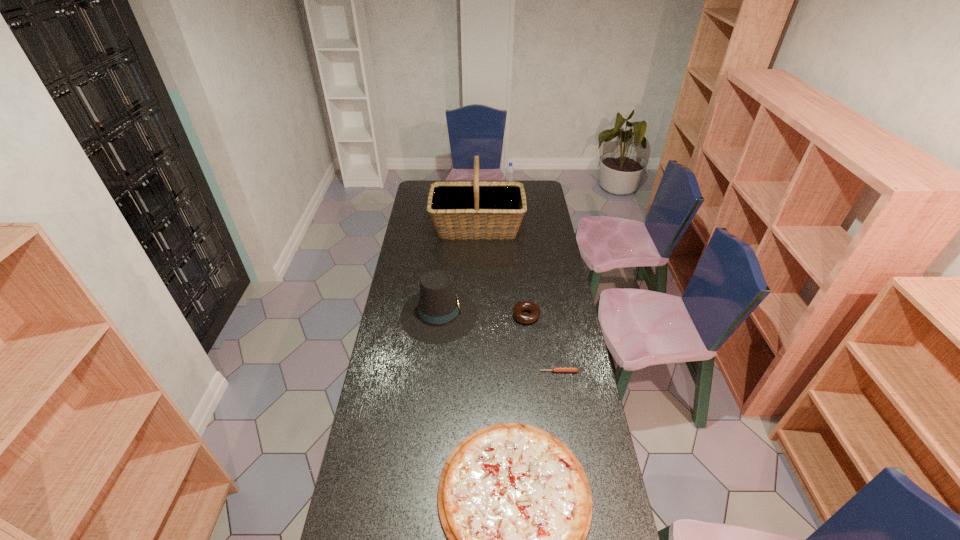
Image resolution: width=960 pixels, height=540 pixels. What are the coordinates of `vacant space that satisfies the following two spatial constraints: 1. on the front-facing side of the hat; 2. on the back side of the second nearest object` in the screenshot? It's located at (433, 372).

Identify the location of free location that satisfies the following two spatial constraints: 1. by the handle of the basket; 2. on the back side of the sausage. This screenshot has height=540, width=960. click(476, 372).

The width and height of the screenshot is (960, 540). What are the coordinates of `vacant position in the image that satisfies the following two spatial constraints: 1. on the back side of the shortest object; 2. on the front-facing side of the hat` in the screenshot? It's located at (549, 314).

Where is `free space that satisfies the following two spatial constraints: 1. by the handle of the tallest object; 2. on the left side of the doughnut`? free space that satisfies the following two spatial constraints: 1. by the handle of the tallest object; 2. on the left side of the doughnut is located at coordinates (476, 316).

Find the location of a particular element. free spot that satisfies the following two spatial constraints: 1. on the front side of the water bottle; 2. on the right side of the shortest object is located at coordinates (526, 372).

This screenshot has width=960, height=540. In order to click on vacant region that satisfies the following two spatial constraints: 1. on the back side of the second nearest object; 2. on the front-facing side of the hat in this screenshot , I will do `click(549, 314)`.